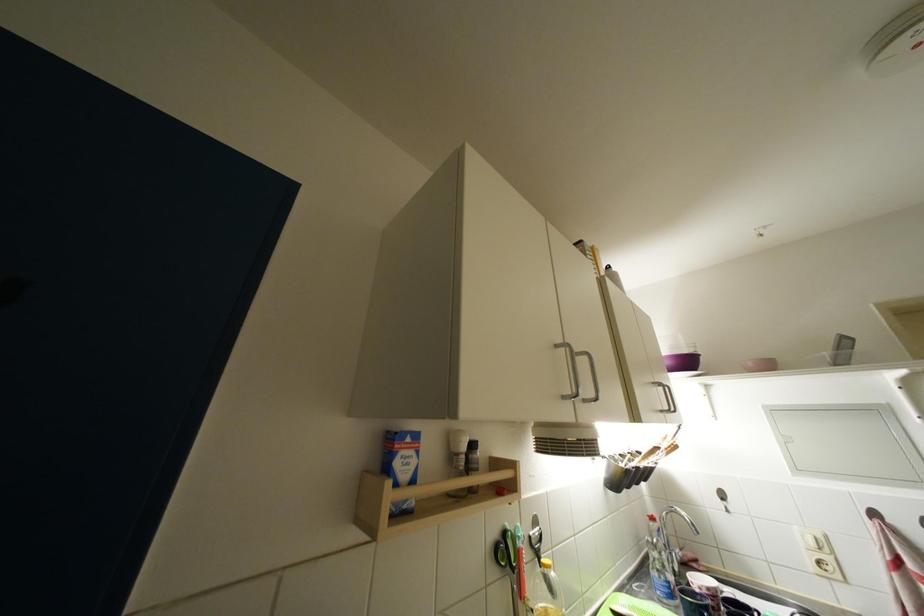
The width and height of the screenshot is (924, 616). What do you see at coordinates (815, 541) in the screenshot?
I see `a white power outlet` at bounding box center [815, 541].